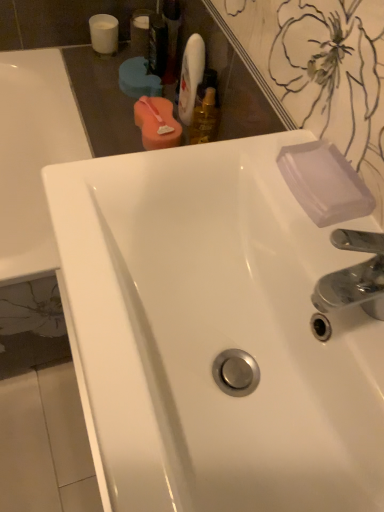
Question: Does translucent plastic mouthwash at upper center, the second mouthwash from the right, have a larger size compared to white matte cup at upper left, positioned as the sixth mouthwash in right-to-left order?

Choices:
 (A) yes
 (B) no

Answer: (A)

Question: From the image's perspective, is translucent plastic mouthwash at upper center, the second mouthwash from the right, located above white matte cup at upper left, positioned as the sixth mouthwash in right-to-left order?

Choices:
 (A) yes
 (B) no

Answer: (B)

Question: From the image's perspective, is translucent plastic mouthwash at upper center, placed as the 5th mouthwash when sorted from left to right, below white matte cup at upper left, positioned as the sixth mouthwash in right-to-left order?

Choices:
 (A) no
 (B) yes

Answer: (B)

Question: Does translucent plastic mouthwash at upper center, placed as the 5th mouthwash when sorted from left to right, appear on the left side of white matte cup at upper left, positioned as the sixth mouthwash in right-to-left order?

Choices:
 (A) yes
 (B) no

Answer: (B)

Question: Is translucent plastic mouthwash at upper center, the second mouthwash from the right, facing away from white matte cup at upper left, the first mouthwash in the left-to-right sequence?

Choices:
 (A) yes
 (B) no

Answer: (B)

Question: From a real-world perspective, is transparent plastic soap at upper right physically located above or below white glossy sink at center?

Choices:
 (A) above
 (B) below

Answer: (A)

Question: Does point (297, 172) appear closer or farther from the camera than point (130, 444)?

Choices:
 (A) closer
 (B) farther

Answer: (B)

Question: From the image's perspective, relative to white glossy sink at center, is transparent plastic soap at upper right above or below?

Choices:
 (A) above
 (B) below

Answer: (A)

Question: Looking at their shapes, would you say transparent plastic soap at upper right is wider or thinner than white glossy sink at center?

Choices:
 (A) thin
 (B) wide

Answer: (A)

Question: Considering the positions of pink sponge at upper center, marked as the third mouthwash in a right-to-left arrangement, and clear plastic bottle at upper center, the second mouthwash from the left, in the image, is pink sponge at upper center, marked as the third mouthwash in a right-to-left arrangement, wider or thinner than clear plastic bottle at upper center, the second mouthwash from the left,?

Choices:
 (A) wide
 (B) thin

Answer: (A)

Question: Based on their positions, is pink sponge at upper center, marked as the third mouthwash in a right-to-left arrangement, located to the left or right of clear plastic bottle at upper center, the second mouthwash from the left?

Choices:
 (A) left
 (B) right

Answer: (B)

Question: From their relative heights in the image, would you say pink sponge at upper center, marked as the third mouthwash in a right-to-left arrangement, is taller or shorter than clear plastic bottle at upper center, the second mouthwash from the left?

Choices:
 (A) tall
 (B) short

Answer: (B)

Question: Based on their sizes in the image, would you say pink sponge at upper center, acting as the fourth mouthwash starting from the left, is bigger or smaller than clear plastic bottle at upper center, the second mouthwash from the left?

Choices:
 (A) big
 (B) small

Answer: (B)

Question: From the image's perspective, relative to transparent plastic soap at upper right, is translucent plastic mouthwash at upper center, the second mouthwash from the right, above or below?

Choices:
 (A) above
 (B) below

Answer: (A)

Question: Considering the positions of point click(203, 48) and point click(296, 167), is point click(203, 48) closer or farther from the camera than point click(296, 167)?

Choices:
 (A) closer
 (B) farther

Answer: (B)